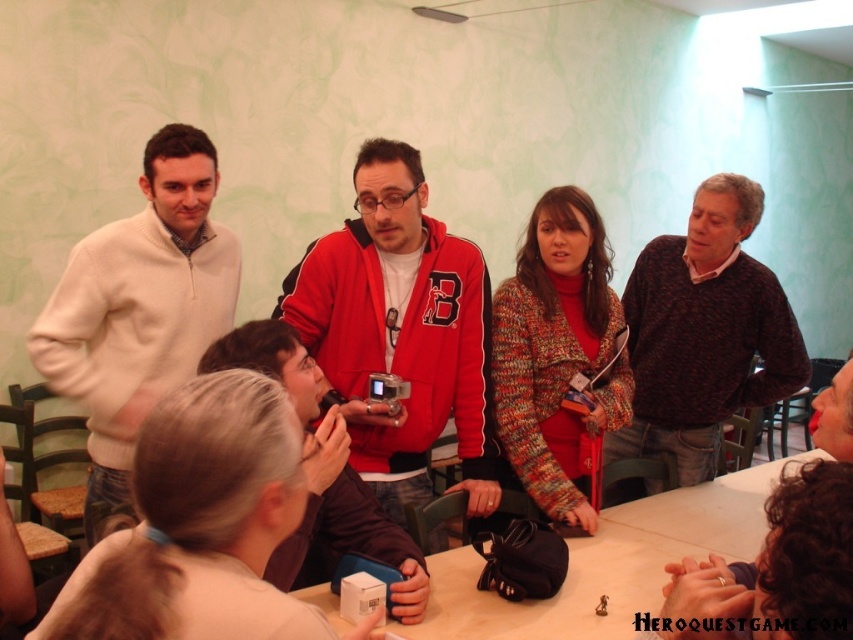
Question: Does white fleece sweater at left have a greater width compared to dark brown sweater at right?

Choices:
 (A) no
 (B) yes

Answer: (A)

Question: Which object appears closest to the camera in this image?

Choices:
 (A) wooden table at center
 (B) dark brown sweater at center

Answer: (B)

Question: Does white fleece sweater at left have a greater width compared to dark brown sweater at center?

Choices:
 (A) no
 (B) yes

Answer: (B)

Question: Which is nearer to the red fleece jacket at center?

Choices:
 (A) wooden table at center
 (B) white fleece sweater at left
 (C) dark brown sweater at center
 (D) dark brown sweater at right

Answer: (B)

Question: Which point is closer to the camera taking this photo?

Choices:
 (A) (141, 211)
 (B) (467, 596)
 (C) (827, 461)
 (D) (396, 445)

Answer: (C)

Question: Does dark brown sweater at right appear on the right side of dark brown sweater at center?

Choices:
 (A) no
 (B) yes

Answer: (B)